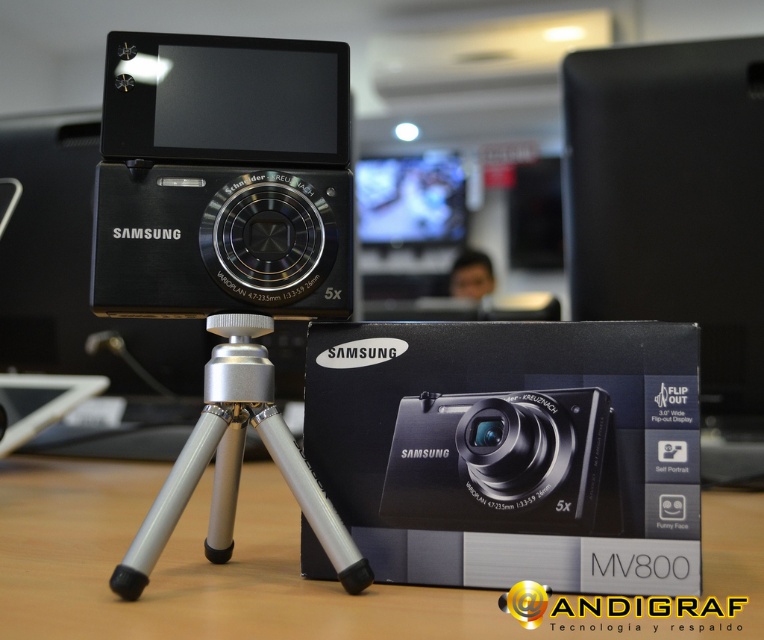
Is matte black camera at center further to the viewer compared to black metallic camera at center?

No, it is not.

What do you see at coordinates (225, 244) in the screenshot? I see `matte black camera at center` at bounding box center [225, 244].

Identify the location of matte black camera at center. (225, 244).

Between point (306, 209) and point (24, 518), which one is positioned in front?

Positioned in front is point (306, 209).

Is black metallic camera at center wider than matte black table at center?

No, black metallic camera at center is not wider than matte black table at center.

Between point (254, 161) and point (280, 618), which one is positioned behind?

Positioned behind is point (254, 161).

Where is `black metallic camera at center`? This screenshot has height=640, width=764. black metallic camera at center is located at coordinates (222, 177).

Between matte black camera at center and silver metallic tripod at center, which one is positioned lower?

silver metallic tripod at center

Consider the image. Is matte black camera at center closer to the viewer compared to silver metallic tripod at center?

No, it is not.

Which is behind, point (144, 99) or point (227, 408)?

Positioned behind is point (144, 99).

The width and height of the screenshot is (764, 640). What are the coordinates of `matte black camera at center` in the screenshot? It's located at (225, 244).